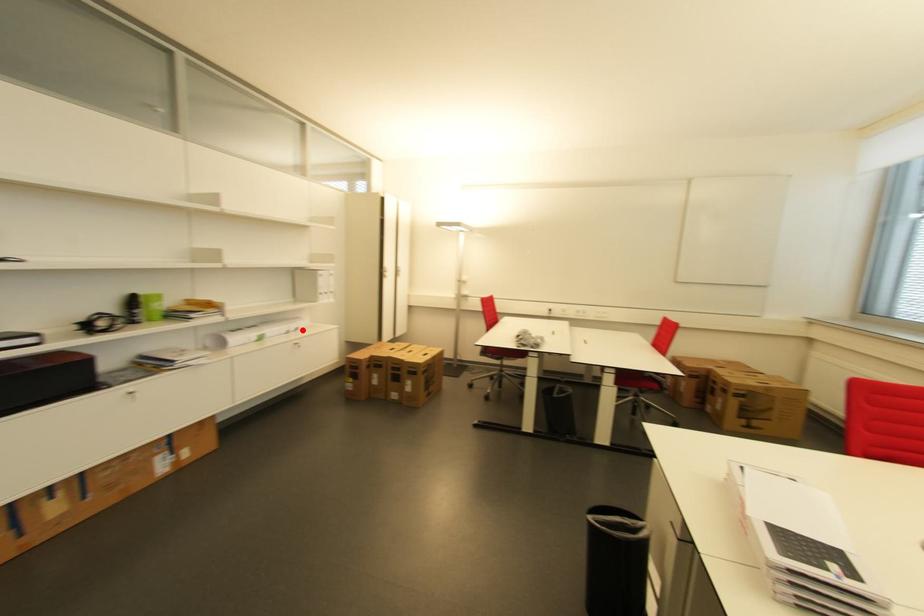
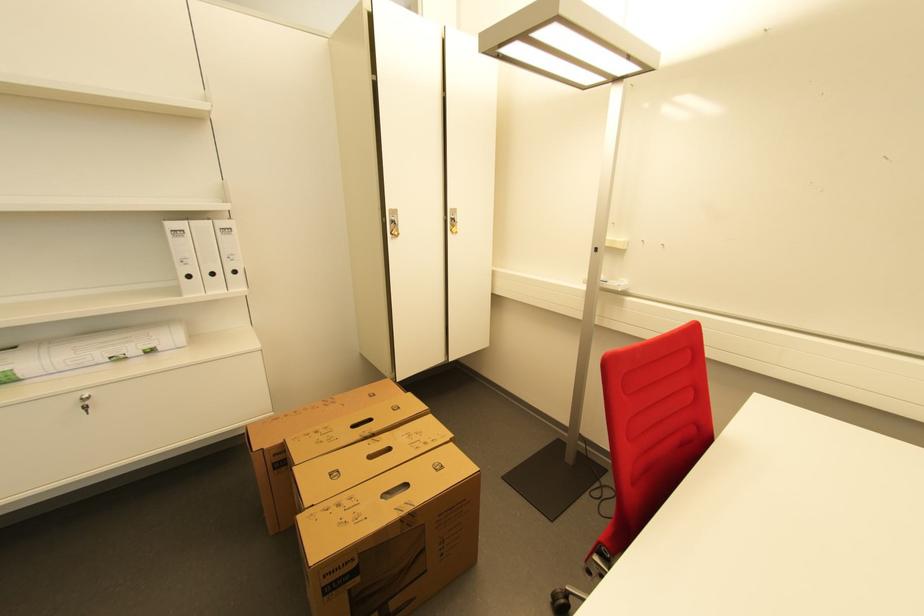
The point at the highlighted location is marked in the first image. Where is the corresponding point in the second image?

(155, 352)